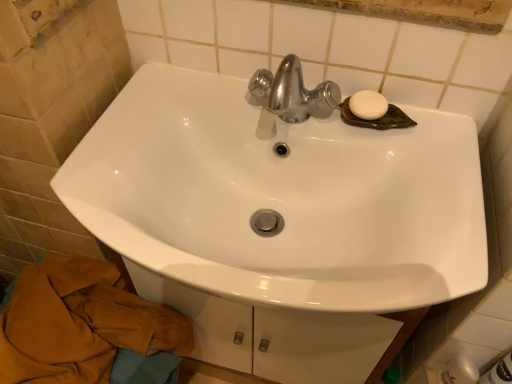
What do you see at coordinates (281, 197) in the screenshot? I see `white glossy sink at center` at bounding box center [281, 197].

Where is `brown cotton bath towel at lower left`? brown cotton bath towel at lower left is located at coordinates (80, 324).

At what (x,y) coordinates should I click in order to perform the action: click on white glossy sink at center. Please return your answer as a coordinate pair (x, y). This screenshot has height=384, width=512. Looking at the image, I should click on (281, 197).

Based on the photo, is brown cotton bath towel at lower left at the back of white matte soap at upper right?

No, brown cotton bath towel at lower left is not at the back of white matte soap at upper right.

In the image, is white matte soap at upper right positioned in front of or behind brown cotton bath towel at lower left?

white matte soap at upper right is positioned farther from the viewer than brown cotton bath towel at lower left.

Between white matte soap at upper right and brown cotton bath towel at lower left, which one has larger width?

With larger width is brown cotton bath towel at lower left.

Which is behind, point (377, 106) or point (85, 272)?

The point (85, 272) is more distant.

Who is shorter, white glossy sink at center or white matte soap at upper right?

With less height is white matte soap at upper right.

Is white glossy sink at center outside of white matte soap at upper right?

Yes, white glossy sink at center is located beyond the bounds of white matte soap at upper right.

Can you confirm if white glossy sink at center is thinner than white matte soap at upper right?

No, white glossy sink at center is not thinner than white matte soap at upper right.

Consider the image. From a real-world perspective, which object rests below the other?

white glossy sink at center.

Between white matte soap at upper right and white glossy sink at center, which one has smaller size?

Smaller between the two is white matte soap at upper right.

Which object is closer to the camera, white matte soap at upper right or white glossy sink at center?

white glossy sink at center is closer to the camera.

Is white matte soap at upper right oriented towards white glossy sink at center?

No, white matte soap at upper right is not facing towards white glossy sink at center.

From the image's perspective, between white matte soap at upper right and white glossy sink at center, who is located below?

From the image's view, white glossy sink at center is below.

Can you confirm if white glossy sink at center is thinner than brown cotton bath towel at lower left?

No, white glossy sink at center is not thinner than brown cotton bath towel at lower left.

Between white glossy sink at center and brown cotton bath towel at lower left, which one has less height?

Standing shorter between the two is white glossy sink at center.

From the image's perspective, is white glossy sink at center under brown cotton bath towel at lower left?

No, from the image's perspective, white glossy sink at center is not beneath brown cotton bath towel at lower left.

Could you tell me if white glossy sink at center is turned towards brown cotton bath towel at lower left?

No, white glossy sink at center is not turned towards brown cotton bath towel at lower left.

From a real-world perspective, between brown cotton bath towel at lower left and white matte soap at upper right, who is vertically higher?

white matte soap at upper right.

Does brown cotton bath towel at lower left appear on the left side of white matte soap at upper right?

Yes.

Where is `soap that is above the brown cotton bath towel at lower left (from a real-world perspective)`? Image resolution: width=512 pixels, height=384 pixels. soap that is above the brown cotton bath towel at lower left (from a real-world perspective) is located at coordinates (368, 105).

Is brown cotton bath towel at lower left oriented towards white matte soap at upper right?

No.

Consider the image. Is brown cotton bath towel at lower left wider or thinner than white glossy sink at center?

Considering their sizes, brown cotton bath towel at lower left looks slimmer than white glossy sink at center.

From a real-world perspective, is brown cotton bath towel at lower left located beneath white glossy sink at center?

Yes, from a real-world perspective, brown cotton bath towel at lower left is below white glossy sink at center.

Where is `sink in front of the brown cotton bath towel at lower left`? sink in front of the brown cotton bath towel at lower left is located at coordinates (281, 197).

Can you confirm if brown cotton bath towel at lower left is shorter than white glossy sink at center?

In fact, brown cotton bath towel at lower left may be taller than white glossy sink at center.

Locate an element on the screen. Image resolution: width=512 pixels, height=384 pixels. bath towel located on the left of white matte soap at upper right is located at coordinates (80, 324).

Identify the location of sink that is below the white matte soap at upper right (from the image's perspective). (281, 197).

From the image, which object appears to be nearer to brown cotton bath towel at lower left, white glossy sink at center or white matte soap at upper right?

Based on the image, white glossy sink at center appears to be nearer to brown cotton bath towel at lower left.

Considering their positions, is brown cotton bath towel at lower left positioned closer to white matte soap at upper right than white glossy sink at center?

white glossy sink at center is positioned closer to the anchor white matte soap at upper right.

Which object lies nearer to the anchor point white glossy sink at center, white matte soap at upper right or brown cotton bath towel at lower left?

white matte soap at upper right.

Consider the image. From the image, which object appears to be nearer to white glossy sink at center, brown cotton bath towel at lower left or white matte soap at upper right?

white matte soap at upper right is closer to white glossy sink at center.

From the image, which object appears to be nearer to white matte soap at upper right, white glossy sink at center or brown cotton bath towel at lower left?

white glossy sink at center lies closer to white matte soap at upper right than the other object.

Which object lies nearer to the anchor point brown cotton bath towel at lower left, white matte soap at upper right or white glossy sink at center?

Based on the image, white glossy sink at center appears to be nearer to brown cotton bath towel at lower left.

This screenshot has height=384, width=512. Find the location of `sink between brown cotton bath towel at lower left and white matte soap at upper right from left to right`. sink between brown cotton bath towel at lower left and white matte soap at upper right from left to right is located at coordinates (281, 197).